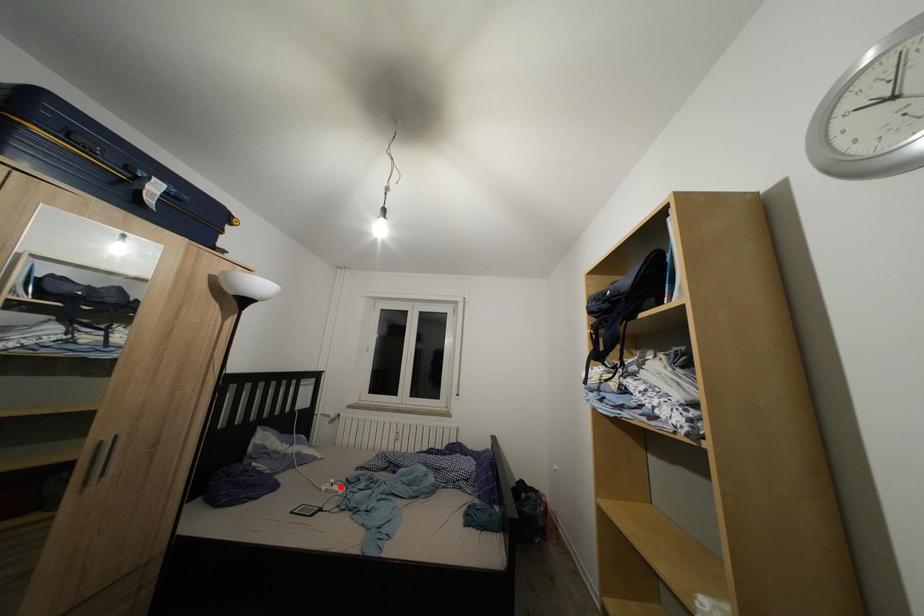
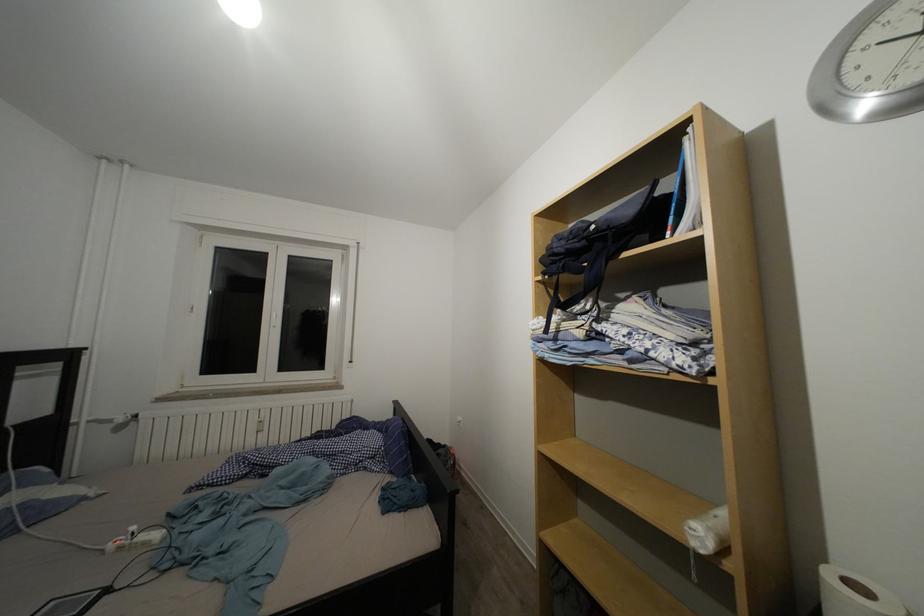
Where in the second image is the point corresponding to the highlighted location from the first image?

(140, 533)